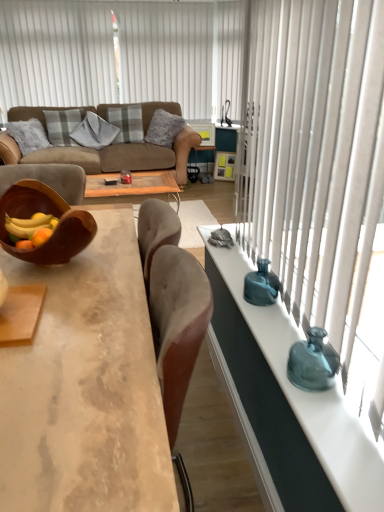
In order to click on vacant point above teal glass vase at right (from a real-world perspective) in this screenshot , I will do `click(291, 349)`.